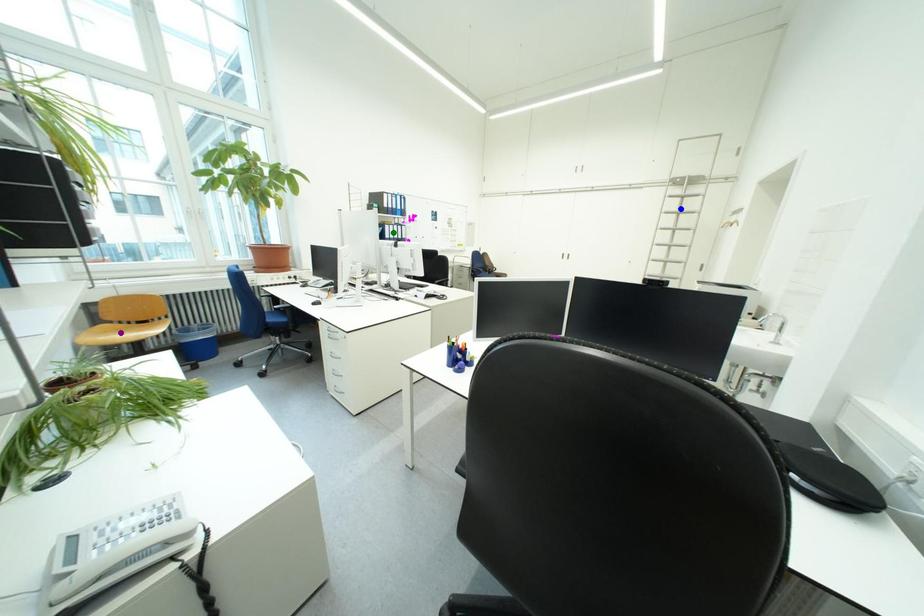
From the picture: Order these from nearest to farthest:
- green point
- purple point
- blue point

blue point → green point → purple point